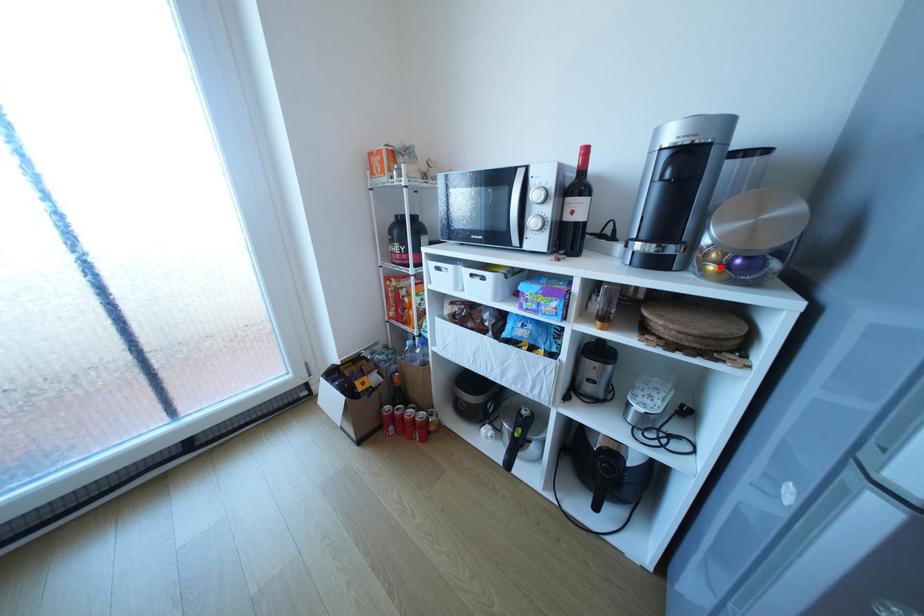
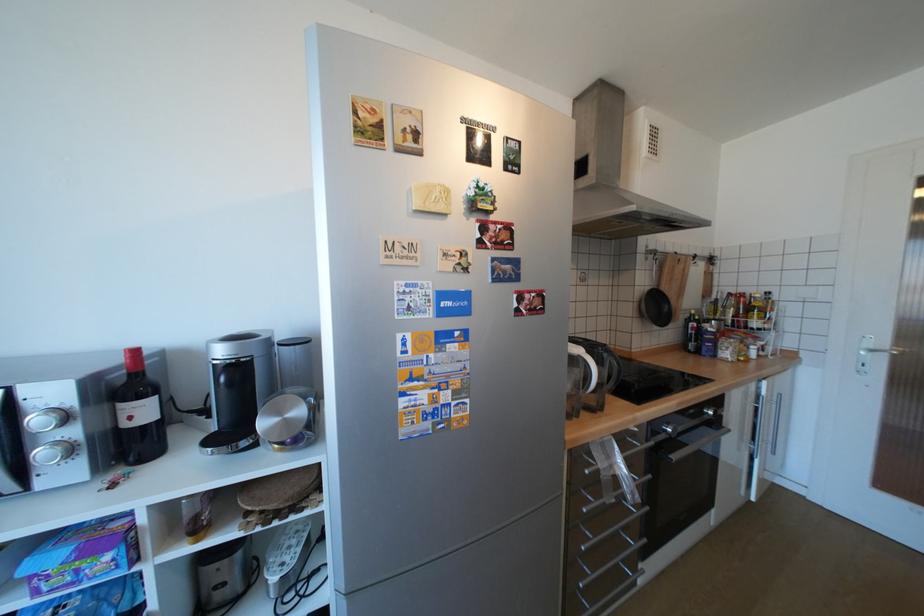
In the second image, find the point that corresponds to the highlighted location in the first image.

(286, 446)